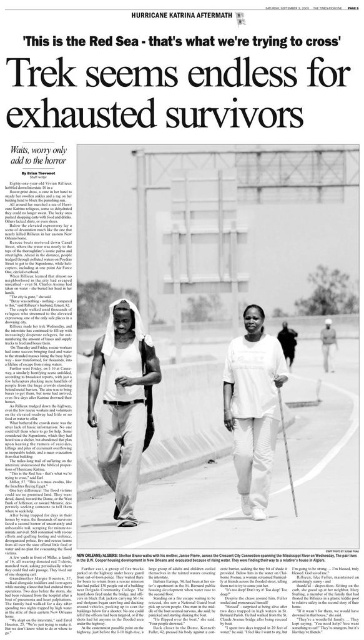
Question: Is white cotton shirt at center below white plastic bag at center?

Choices:
 (A) yes
 (B) no

Answer: (A)

Question: Does white cotton shirt at center appear on the right side of dark brown leather bag at center?

Choices:
 (A) yes
 (B) no

Answer: (B)

Question: Which point is closer to the camera taking this photo?

Choices:
 (A) (329, 365)
 (B) (266, 396)

Answer: (B)

Question: Is white cotton shirt at center to the right of dark brown leather bag at center from the viewer's perspective?

Choices:
 (A) no
 (B) yes

Answer: (A)

Question: Estimate the real-world distances between objects in this image. Which object is farther from the white cotton shirt at center?

Choices:
 (A) white cotton tank top at center
 (B) dark brown leather bag at center
 (C) white plastic bag at center

Answer: (C)

Question: Based on their relative distances, which object is nearer to the white plastic bag at center?

Choices:
 (A) white cotton tank top at center
 (B) dark brown leather bag at center
 (C) white cotton shirt at center

Answer: (B)